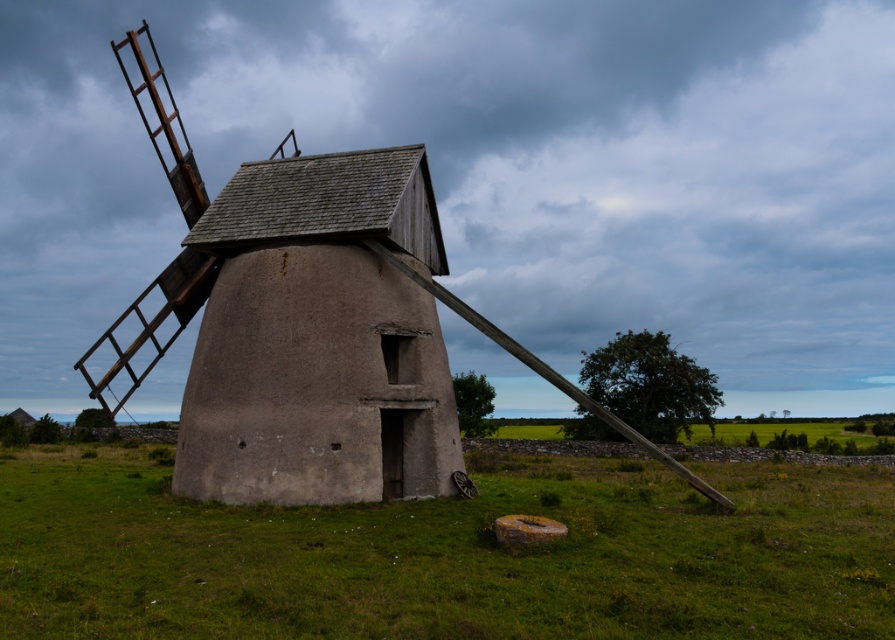
You are a gardener planning to plant flowers in the area around the brown textured stone windmill at center. Considering the green grass at center is larger in size, do you think there is enough space to plant flowers around the windmill without overcrowding?

The green grass at center has a larger size compared to the brown textured stone windmill at center, so there is enough space to plant flowers around the windmill without overcrowding.

You are standing at the edge of the field looking towards the windmill. Which direction should you walk to reach the green grass at center from the brown textured stone windmill at center?

To reach the green grass at center from the brown textured stone windmill at center, you should walk to the right since the green grass at center is located to the right of the windmill.

You are an architect analyzing the structure of the windmill in the image. Which part of the windmill is positioned lower in the image, the rustic wood windmill at center or the brown textured stone windmill at center?

The rustic wood windmill at center is positioned lower in the image than the brown textured stone windmill at center.